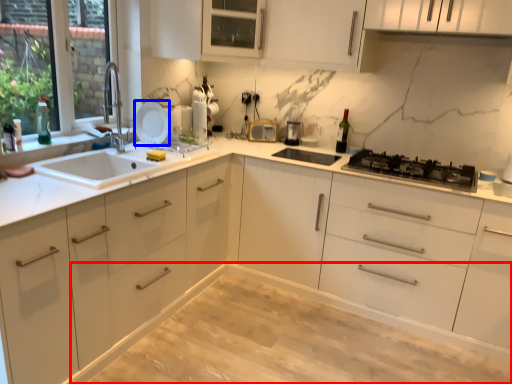
Question: Which of the following is the closest to the observer, dinning table (highlighted by a red box) or appliance (highlighted by a blue box)?

Choices:
 (A) dinning table
 (B) appliance

Answer: (A)